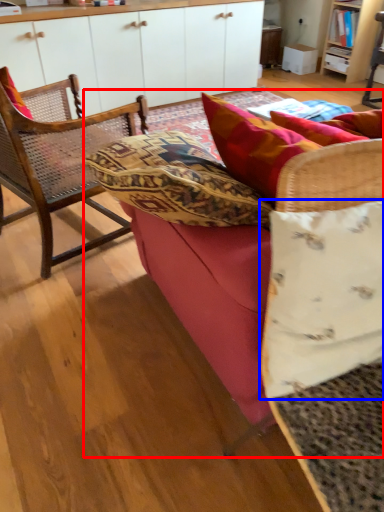
Question: Among these objects, which one is nearest to the camera, studio couch (highlighted by a red box) or pillow (highlighted by a blue box)?

Choices:
 (A) studio couch
 (B) pillow

Answer: (B)